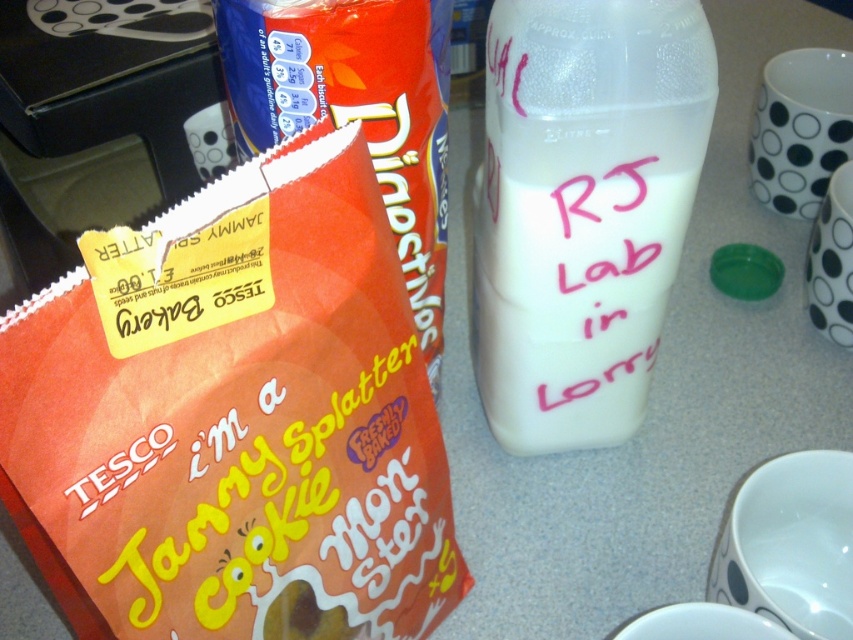
Question: Which is nearer to the orange paper bag at left?

Choices:
 (A) white marker text at center
 (B) white opaque milk at center

Answer: (B)

Question: Is orange paper bag at left above orange paper bag at center?

Choices:
 (A) yes
 (B) no

Answer: (B)

Question: Can you confirm if orange paper bag at center is smaller than white marker text at center?

Choices:
 (A) no
 (B) yes

Answer: (A)

Question: Estimate the real-world distances between objects in this image. Which object is closer to the orange paper bag at left?

Choices:
 (A) white opaque milk at center
 (B) white marker text at center

Answer: (A)

Question: Which object appears farthest from the camera in this image?

Choices:
 (A) white opaque milk at center
 (B) white marker text at center

Answer: (B)

Question: Is the position of orange paper bag at left less distant than that of white opaque milk at center?

Choices:
 (A) yes
 (B) no

Answer: (A)